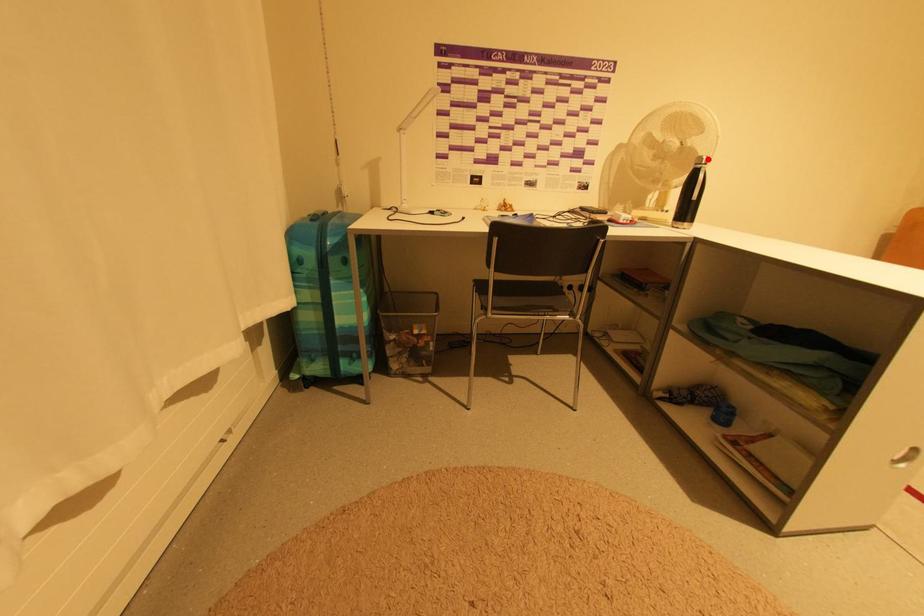
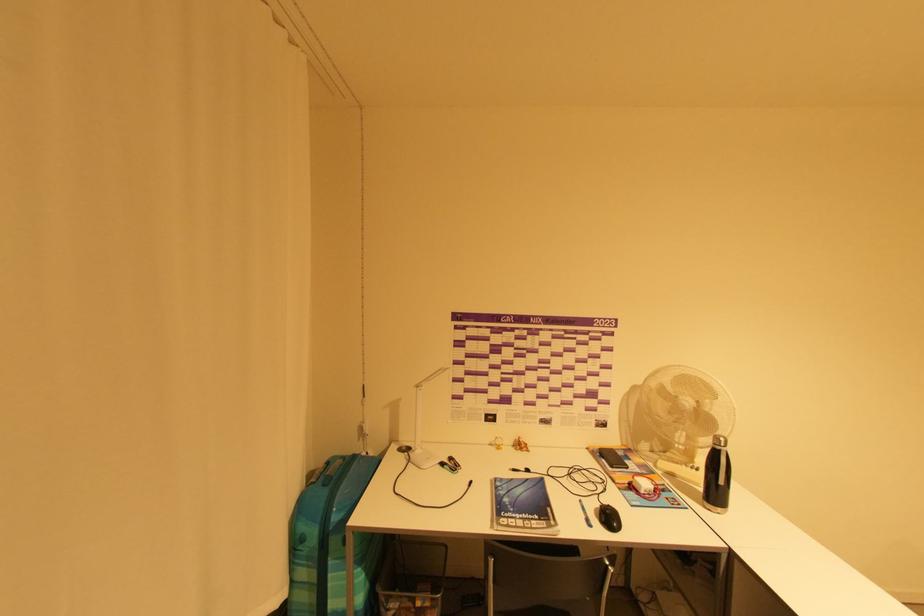
In the second image, find the point that corresponds to the highlighted location in the first image.

(726, 440)